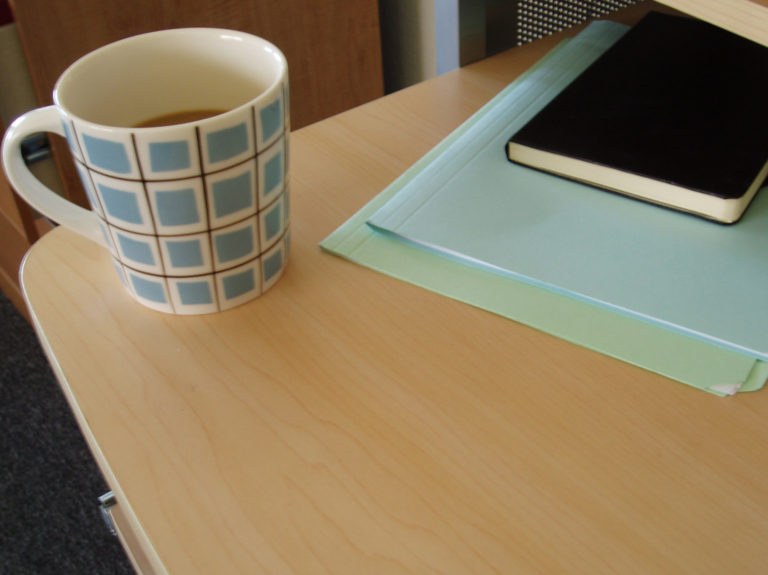
Where is `black bound book`? black bound book is located at coordinates (674, 116).